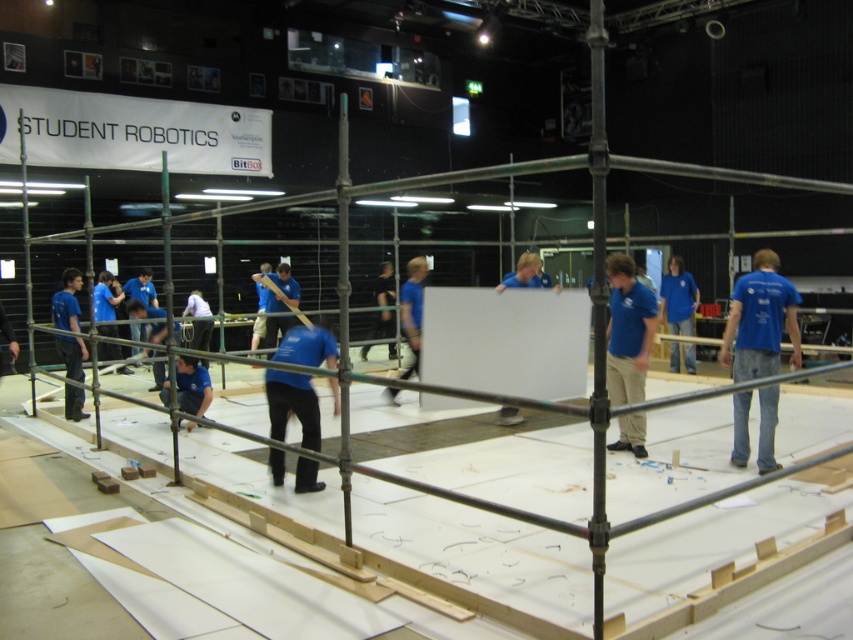
Question: Which object is farther from the camera taking this photo?

Choices:
 (A) blue cotton shirt at center
 (B) matte blue shirt at lower left
 (C) blue shirt at center

Answer: (C)

Question: Does matte blue shirt at lower left have a larger size compared to blue shirt at center?

Choices:
 (A) no
 (B) yes

Answer: (B)

Question: Among these points, which one is farthest from the camera?

Choices:
 (A) (631, 339)
 (B) (70, 269)
 (C) (688, 280)

Answer: (C)

Question: Which is nearer to the blue shirt at center?

Choices:
 (A) blue cotton shirt at center
 (B) matte blue shirt at lower left

Answer: (A)

Question: Can you confirm if blue cotton shirt at center is positioned above matte blue shirt at lower left?

Choices:
 (A) yes
 (B) no

Answer: (A)

Question: In this image, where is blue cotton shirt at center located relative to blue shirt at center?

Choices:
 (A) above
 (B) below

Answer: (B)